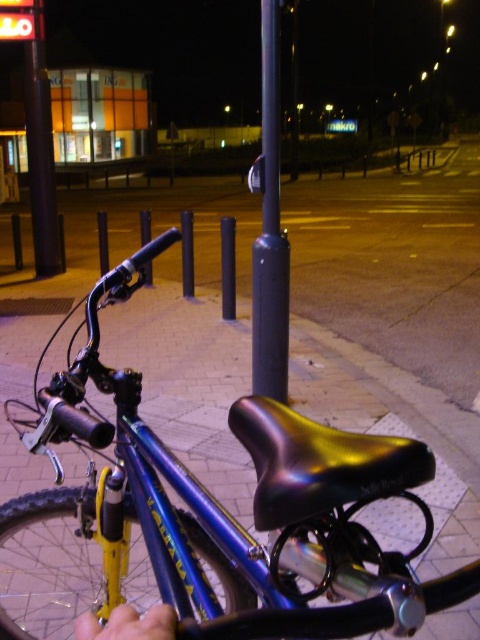
You are standing in front of the bicycle and want to know which of the two points, point (275, 38) or point (44, 250), is closer to you. Can you determine this based on the scene?

Point (275, 38) is closer to the viewer than point (44, 250).

You are a delivery person who needs to park your blue metallic bicycle at center near the smooth black pole at upper left. Given their sizes, will the bicycle fit next to the pole without overlapping?

The blue metallic bicycle at center is larger in size than the smooth black pole at upper left, so there should be enough space to park the bicycle next to the pole without overlapping.

You are a delivery person who needs to load a package onto the blue metallic bicycle at center and the smooth black pole at upper left. Which object should you approach first to ensure you can reach both without moving the bicycle?

You should approach the blue metallic bicycle at center first because it is closer to the viewer than the smooth black pole at upper left, so you can reach it more easily before accessing the pole.